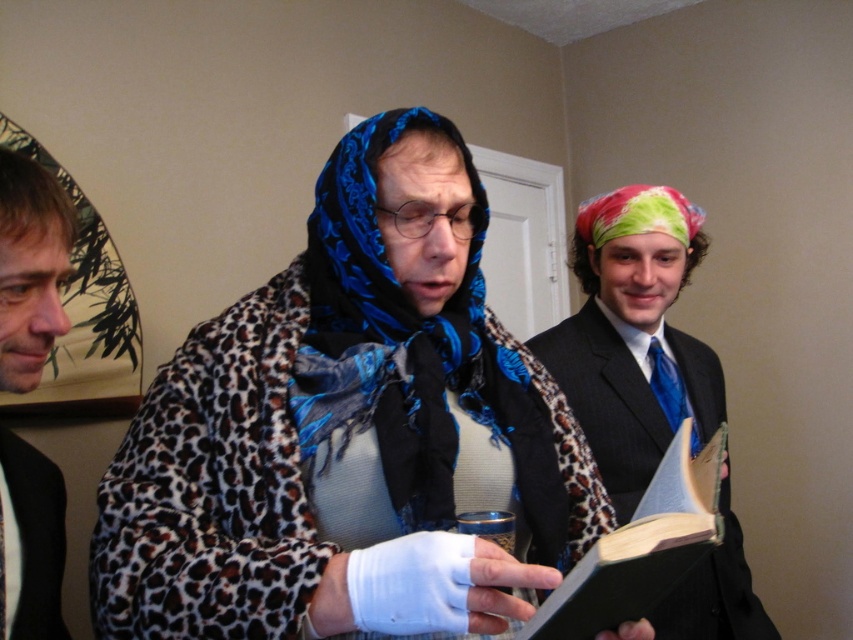
You are a photographer setting up for a group photo. You need to position two people with smooth brown hair at left and blonde hair at left so that they are exactly 6 inches apart. Based on the current setup, will you need to move them closer or farther apart?

The distance between smooth brown hair at left and blonde hair at left is currently 6.61 inches. Since 6.61 inches is greater than 6 inches, you should move them closer together to achieve the desired distance.

The scene shows a central figure reading from an open book while holding a white bandage on one hand. There is also a person in formal attire standing to the right. Can you determine if the hardcover book at center is located to the left or right of the point at coordinates (x=642, y=547)?

The point at coordinates (x=642, y=547) corresponds to the hardcover book at center, so the hardcover book at center is located exactly at that point.